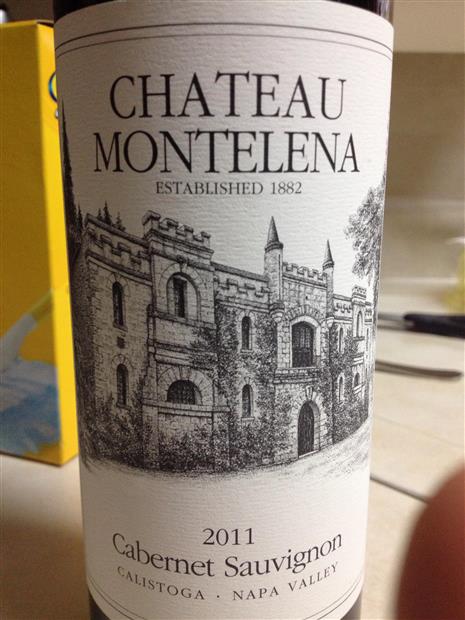
Where is `wood table`? wood table is located at coordinates (32, 525), (386, 516), (398, 461), (436, 348), (423, 421).